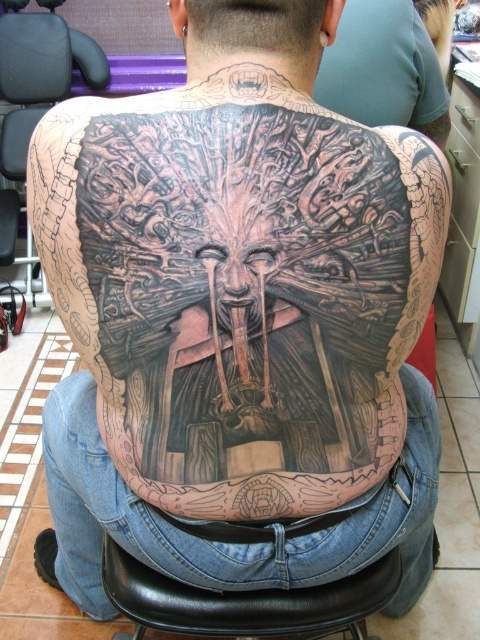
Question: Which of the following is the farthest from the observer?

Choices:
 (A) (85, 72)
 (B) (360, 120)

Answer: (A)

Question: From the image, what is the correct spatial relationship of black tattooed skin at center in relation to black leather chair at upper left?

Choices:
 (A) above
 (B) below

Answer: (B)

Question: Can you confirm if black leather chair at lower center is thinner than black tattooed skin at center?

Choices:
 (A) yes
 (B) no

Answer: (B)

Question: Considering the real-world distances, which object is closest to the black leather chair at upper left?

Choices:
 (A) black leather chair at lower center
 (B) black tattooed skin at center

Answer: (B)

Question: Does black leather chair at lower center have a smaller size compared to black leather chair at upper left?

Choices:
 (A) yes
 (B) no

Answer: (B)

Question: Which object is positioned farthest from the black leather chair at upper left?

Choices:
 (A) black leather chair at lower center
 (B) black tattooed skin at center

Answer: (A)